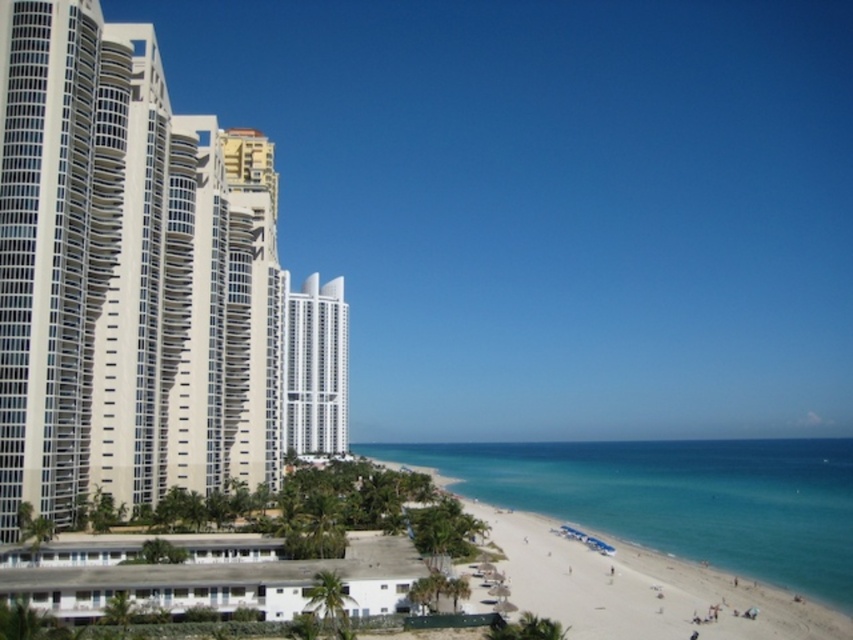
You are a photographer planning to capture the entire beach scene from the shore. Given that the white glass building at left and the clear blue water at beach right are both in your view, which object appears narrower in your photo?

The white glass building at left appears narrower than the clear blue water at beach right in the photo.

You are standing on the beach and see two points marked in the image. Which point is closer to you, point (x=805, y=468) or point (x=285, y=316)?

Point (x=285, y=316) is closer to you because it is less further to the viewer than point (x=805, y=468).

You are standing on the beach and want to take a photo of the white glossy building at center and the clear blue water at beach right. Where should you position yourself to ensure both are visible in the frame?

Position yourself so that the white glossy building at center is above the clear blue water at beach right in your viewfinder, as the clear blue water at beach right is located below the white glossy building at center.